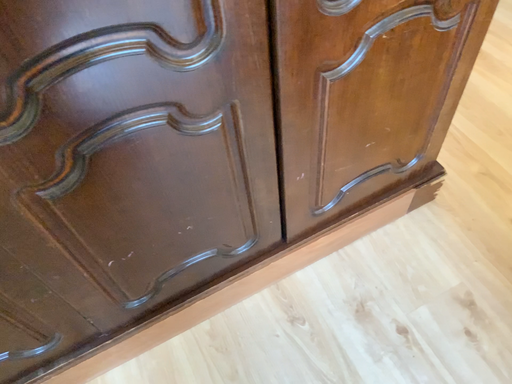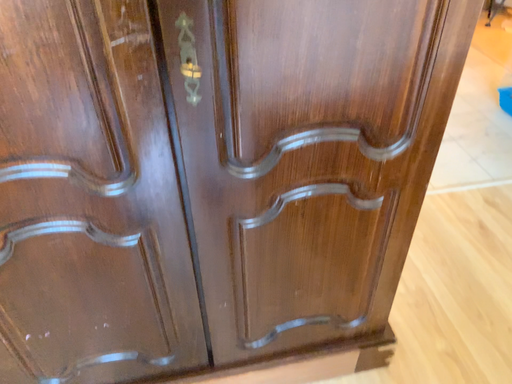
Question: How did the camera likely rotate when shooting the video?

Choices:
 (A) rotated right
 (B) rotated left

Answer: (B)